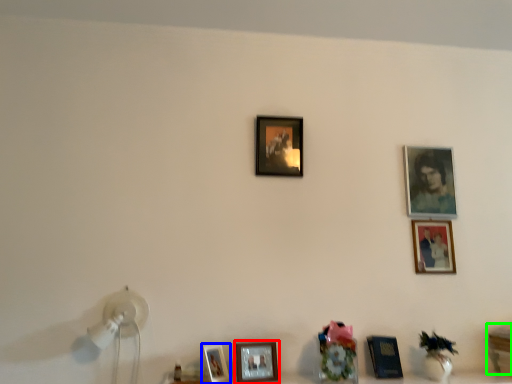
Question: Which object is the farthest from picture frame (highlighted by a red box)? Choose among these: picture frame (highlighted by a blue box) or table (highlighted by a green box).

Choices:
 (A) picture frame
 (B) table

Answer: (B)